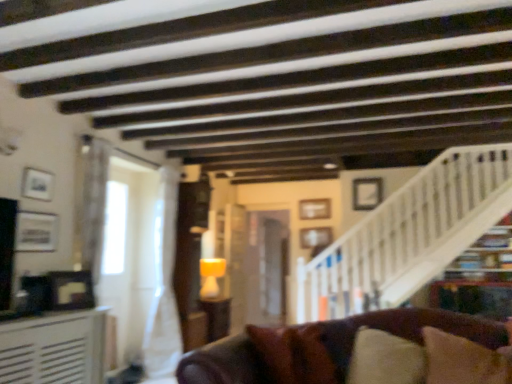
Question: Should I look upward or downward to see matte brown table at center, the 2th table from the front?

Choices:
 (A) up
 (B) down

Answer: (B)

Question: Is white wooden stairwell at upper right beside wooden picture frame at center, the second picture frame viewed from the back?

Choices:
 (A) yes
 (B) no

Answer: (B)

Question: From the image's perspective, is white wooden stairwell at upper right over wooden picture frame at center, positioned as the 4th picture frame in left-to-right order?

Choices:
 (A) yes
 (B) no

Answer: (A)

Question: From the image's perspective, is white wooden stairwell at upper right under wooden picture frame at center, positioned as the 4th picture frame in left-to-right order?

Choices:
 (A) no
 (B) yes

Answer: (A)

Question: Does white wooden stairwell at upper right contain wooden picture frame at center, which is the second picture frame from right to left?

Choices:
 (A) yes
 (B) no

Answer: (B)

Question: Does white wooden stairwell at upper right have a greater height compared to wooden picture frame at center, which is the second picture frame from right to left?

Choices:
 (A) no
 (B) yes

Answer: (B)

Question: Is white wooden stairwell at upper right at the left side of wooden picture frame at center, which is the second picture frame from right to left?

Choices:
 (A) no
 (B) yes

Answer: (A)

Question: Does white matte picture frame at upper right, the third picture frame positioned from the back, lie behind matte white picture frame at upper left, placed as the 4th picture frame when sorted from back to front?

Choices:
 (A) yes
 (B) no

Answer: (A)

Question: Considering the relative sizes of white matte picture frame at upper right, the third picture frame positioned from the back, and matte white picture frame at upper left, the first picture frame in the left-to-right sequence, in the image provided, is white matte picture frame at upper right, the third picture frame positioned from the back, thinner than matte white picture frame at upper left, the first picture frame in the left-to-right sequence,?

Choices:
 (A) no
 (B) yes

Answer: (A)

Question: From the image's perspective, is white matte picture frame at upper right, the third picture frame positioned from the back, under matte white picture frame at upper left, which is the 5th picture frame in right-to-left order?

Choices:
 (A) yes
 (B) no

Answer: (A)

Question: From a real-world perspective, is white matte picture frame at upper right, the 5th picture frame when ordered from left to right, physically below matte white picture frame at upper left, which is the 5th picture frame in right-to-left order?

Choices:
 (A) yes
 (B) no

Answer: (B)

Question: Considering the relative sizes of white matte picture frame at upper right, which ranks as the 3th picture frame in front-to-back order, and matte white picture frame at upper left, the first picture frame in the left-to-right sequence, in the image provided, is white matte picture frame at upper right, which ranks as the 3th picture frame in front-to-back order, wider than matte white picture frame at upper left, the first picture frame in the left-to-right sequence,?

Choices:
 (A) no
 (B) yes

Answer: (B)

Question: Is white matte picture frame at upper right, which ranks as the 3th picture frame in front-to-back order, oriented towards matte white picture frame at upper left, the first picture frame in the left-to-right sequence?

Choices:
 (A) no
 (B) yes

Answer: (A)

Question: Is white matte picture frame at upper right, the third picture frame positioned from the back, at the back of matte silver picture frame at left, placed as the 5th picture frame when sorted from back to front?

Choices:
 (A) yes
 (B) no

Answer: (B)